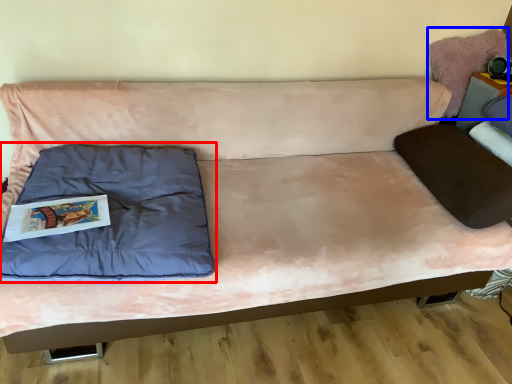
Question: Which object appears closest to the camera in this image, pillow (highlighted by a red box) or swivel chair (highlighted by a blue box)?

Choices:
 (A) pillow
 (B) swivel chair

Answer: (A)